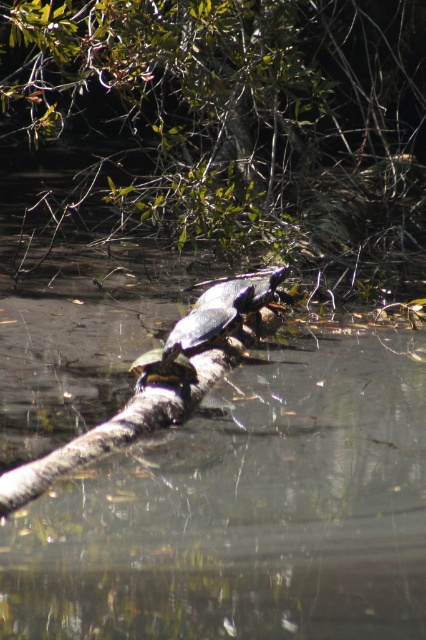
Question: Does clear water at branch center appear on the left side of green leafy tree at upper center?

Choices:
 (A) no
 (B) yes

Answer: (A)

Question: From the image, what is the correct spatial relationship of green leafy tree at upper center in relation to shiny dark green tortoise at center?

Choices:
 (A) left
 (B) right

Answer: (A)

Question: Which of these objects is positioned farthest from the shiny dark green tortoise at center?

Choices:
 (A) shiny brown tortoise at center
 (B) clear water at branch center

Answer: (B)

Question: Which of the following is the farthest from the observer?

Choices:
 (A) (135, 369)
 (B) (176, 621)
 (C) (321, 12)

Answer: (C)

Question: Observing the image, what is the correct spatial positioning of clear water at branch center in reference to shiny dark green tortoise at center?

Choices:
 (A) above
 (B) below

Answer: (B)

Question: Which point is farther to the camera?

Choices:
 (A) (181, 346)
 (B) (216, 243)
 (C) (173, 381)
 (D) (316, 353)

Answer: (B)